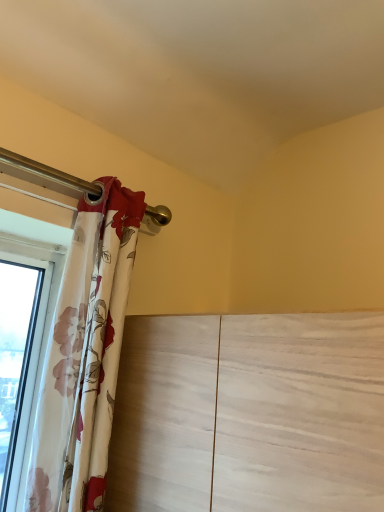
What is the approximate width of floral fabric curtain at left?

It is 7.05 inches.

Locate an element on the screen. floral fabric curtain at left is located at coordinates (84, 356).

What do you see at coordinates (84, 356) in the screenshot?
I see `floral fabric curtain at left` at bounding box center [84, 356].

This screenshot has height=512, width=384. What are the coordinates of `floral fabric curtain at left` in the screenshot? It's located at (84, 356).